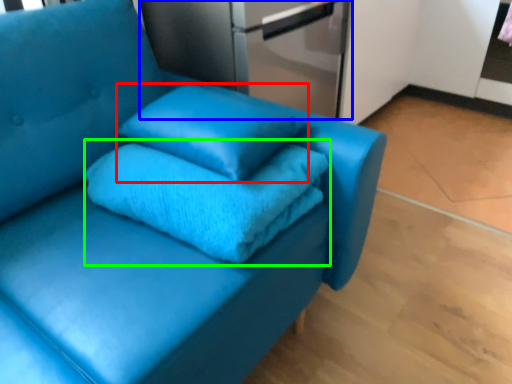
Question: Which is farther away from pillow (highlighted by a red box)? appliance (highlighted by a blue box) or bath towel (highlighted by a green box)?

Choices:
 (A) appliance
 (B) bath towel

Answer: (A)